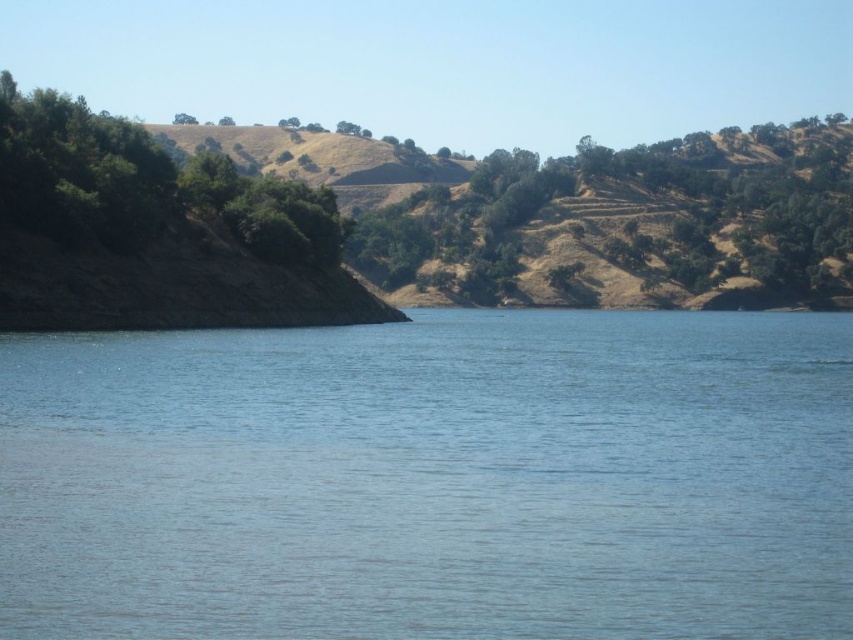
You are standing at the edge of the blue water at center and want to walk to the dry grassy hillside at upper center. Which direction should you face to head towards it?

You should face upwards because the dry grassy hillside at upper center is located above the blue water at center, which is closer to the viewer.

You are standing at the edge of the lake and looking out across the water. There are two points marked on the image, point 1 at coordinates point (x=149, y=461) and point 2 at coordinates point (x=172, y=118). Which point is closer to you?

Point (x=149, y=461) is closer to you than point (x=172, y=118).

You are standing on the shore and looking towards the blue water at center and the green leafy tree at upper center. Which object is closer to you?

The blue water at center is closer to you because it is positioned in front of the green leafy tree at upper center.